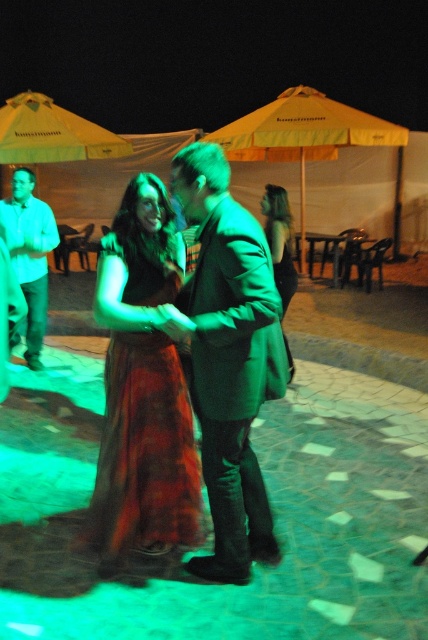
You are a photographer at the event and want to capture a photo where both the matte green dress at center and the yellow fabric umbrella at upper center are visible. Considering their sizes, which object should you ensure is closer to the camera to avoid it being too small in the frame?

The matte green dress at center is taller than the yellow fabric umbrella at upper center. To ensure both are visible and neither appears too small, position the matte green dress at center closer to the camera since it is larger and might need to be framed appropriately.

You are at a party and want to take a photo of both the matte white shirt at left and the green matte dress at center. Which one should you focus on first to ensure both are in the frame?

The matte white shirt at left is positioned on the left side of green matte dress at center, so you should focus on the matte white shirt at left first to ensure both are in the frame.

Consider the image. You are a photographer at the event and want to capture a photo of the matte green dress at center. Where should you position your camera to ensure it is centered in the frame?

To center the matte green dress at center in the frame, position your camera at the coordinates corresponding to point 0.573 on the x and 0.439 on the y axis, as the 2D location of the matte green dress at center is at point (187, 365).